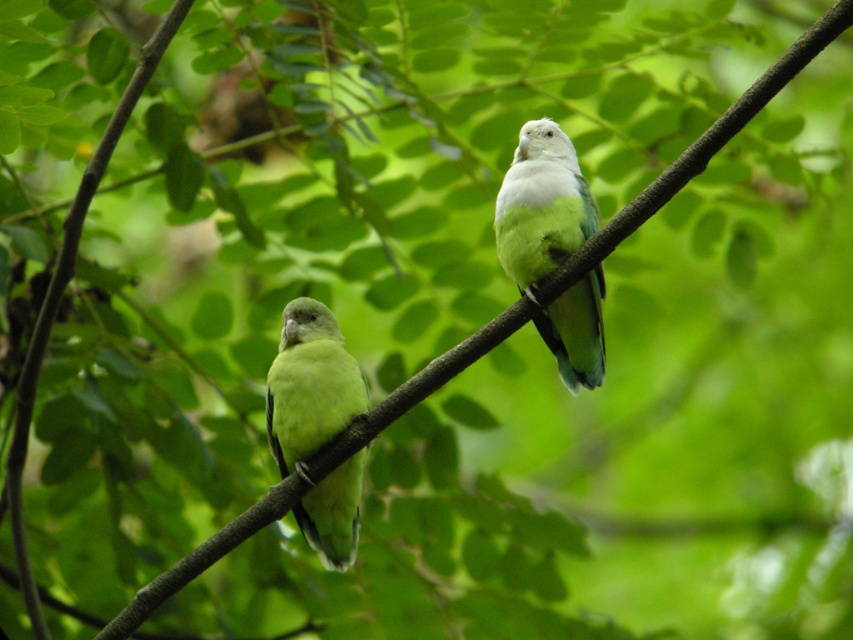
Which is more to the left, green matte parrot at center or green matte parrot at left?

From the viewer's perspective, green matte parrot at left appears more on the left side.

Measure the distance between point [527,131] and camera.

2.72 meters

Locate an element on the screen. The width and height of the screenshot is (853, 640). green matte parrot at center is located at coordinates (541, 205).

This screenshot has width=853, height=640. Identify the location of green matte parrot at center. (541, 205).